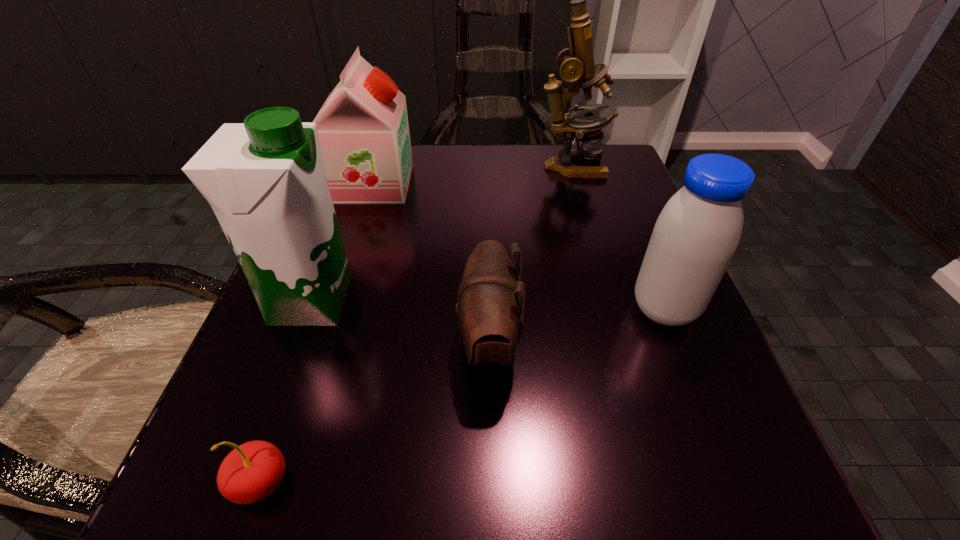
I want to click on vacant region located with the cap open on the farthest soya milk, so [485, 183].

Where is `vacant space situated 0.230m on the front of the rightmost soya milk`? The width and height of the screenshot is (960, 540). vacant space situated 0.230m on the front of the rightmost soya milk is located at coordinates (743, 505).

Locate an element on the screen. The image size is (960, 540). free space located 0.270m with the flap open on the pouch is located at coordinates (268, 342).

Where is `blank area located 0.170m with the flap open on the pouch`? The height and width of the screenshot is (540, 960). blank area located 0.170m with the flap open on the pouch is located at coordinates click(338, 342).

At what (x,y) coordinates should I click in order to perform the action: click on free space located with the flap open on the pouch. Please return your answer as a coordinate pair (x, y). The image size is (960, 540). Looking at the image, I should click on [x=331, y=342].

Locate an element on the screen. The image size is (960, 540). free space located on the back of the cherry is located at coordinates (328, 289).

Where is `microscope that is at the far edge`? The height and width of the screenshot is (540, 960). microscope that is at the far edge is located at coordinates (576, 64).

In order to click on soya milk located in the far edge section of the desktop in this screenshot , I will do `click(363, 130)`.

You are a GUI agent. You are given a task and a screenshot of the screen. Output one action in this format:
    pyautogui.click(x=<x>, y=<y>)
    Task: Click on the object at the near edge
    This screenshot has width=960, height=540.
    Given the screenshot: What is the action you would take?
    pyautogui.click(x=251, y=472)

At what (x,y) coordinates should I click in order to perform the action: click on cherry that is at the left edge. Please return your answer as a coordinate pair (x, y). This screenshot has height=540, width=960. Looking at the image, I should click on (251, 472).